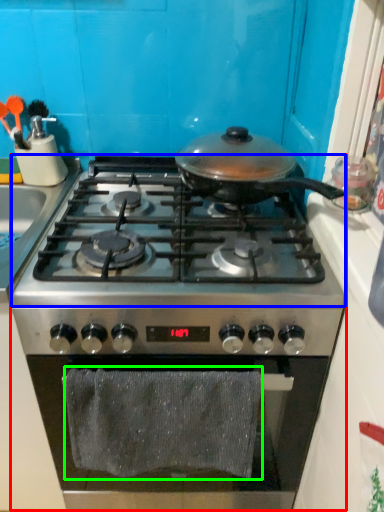
Question: Which is farther away from gas stove (highlighted by a red box)? gas stove (highlighted by a blue box) or bath towel (highlighted by a green box)?

Choices:
 (A) gas stove
 (B) bath towel

Answer: (A)